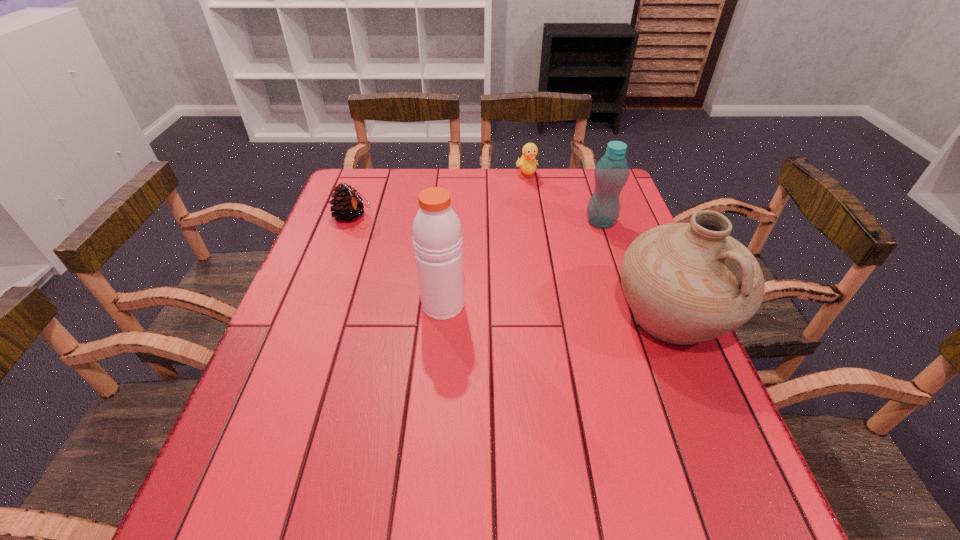
This screenshot has width=960, height=540. What are the coordinates of `vacant space on the desktop that is between the second object from left to right and the pottery and is positioned at the front cap of the water bottle` in the screenshot? It's located at (536, 310).

The image size is (960, 540). In order to click on vacant spot on the desktop that is between the second object from left to right and the pottery and is positioned with a leaf charm attached to the pinecone in this screenshot , I will do (x=527, y=309).

Where is `vacant space on the desktop that is between the second object from left to right and the pottery and is positioned on the front-facing side of the farthest object`? The image size is (960, 540). vacant space on the desktop that is between the second object from left to right and the pottery and is positioned on the front-facing side of the farthest object is located at coordinates (587, 312).